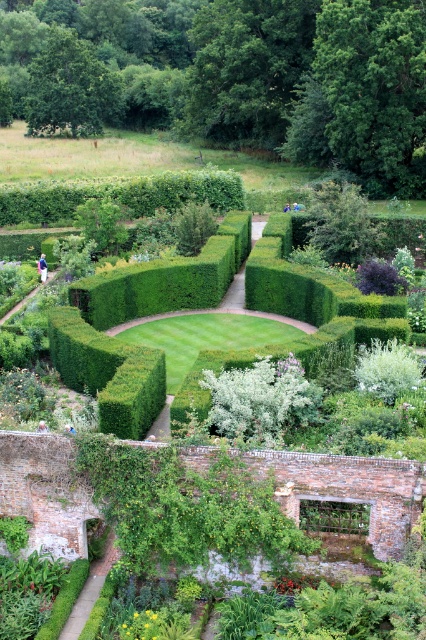
Can you confirm if green leafy hedge at upper left is shorter than green leafy bush at center?

Correct, green leafy hedge at upper left is not as tall as green leafy bush at center.

In the scene shown: Between green leafy hedge at upper left and green leafy bush at center, which one is positioned lower?

Positioned lower is green leafy bush at center.

What do you see at coordinates (120, 195) in the screenshot?
I see `green leafy hedge at upper left` at bounding box center [120, 195].

The image size is (426, 640). I want to click on green leafy hedge at upper left, so click(x=120, y=195).

Between green leafy hedge at upper left and light brown wooden bench at lower center, which one is positioned lower?

Positioned lower is light brown wooden bench at lower center.

Where is `green leafy hedge at upper left`? The image size is (426, 640). green leafy hedge at upper left is located at coordinates (120, 195).

Locate an element on the screen. The width and height of the screenshot is (426, 640). green leafy hedge at upper left is located at coordinates (120, 195).

Does green leafy hedge at upper left appear over white fluffy bush at center?

Correct, green leafy hedge at upper left is located above white fluffy bush at center.

Does green leafy hedge at upper left have a lesser width compared to white fluffy bush at center?

In fact, green leafy hedge at upper left might be wider than white fluffy bush at center.

Measure the distance between point (132, 204) and camera.

The distance of point (132, 204) from camera is 59.10 meters.

This screenshot has width=426, height=640. In order to click on green leafy hedge at upper left in this screenshot , I will do `click(120, 195)`.